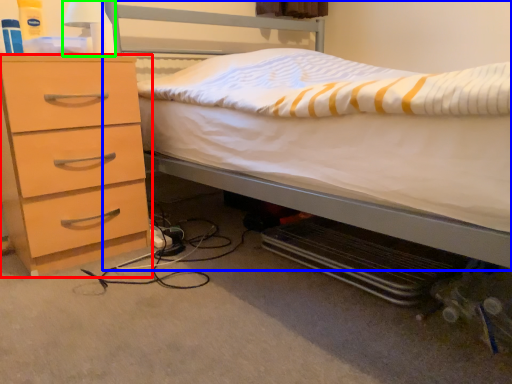
Question: Based on their relative distances, which object is nearer to chest of drawers (highlighted by a red box)? Choose from bed (highlighted by a blue box) and bedside lamp (highlighted by a green box).

Choices:
 (A) bed
 (B) bedside lamp

Answer: (B)